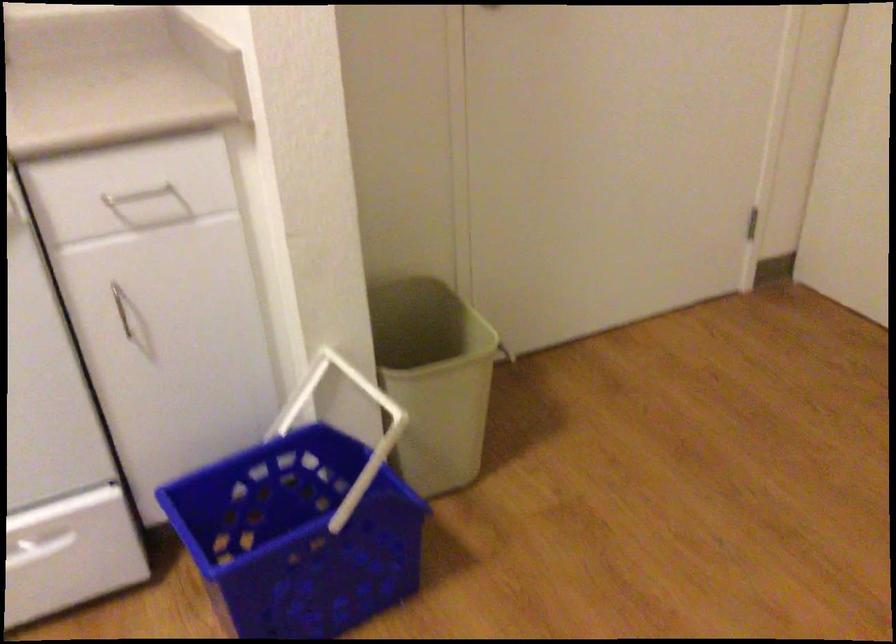
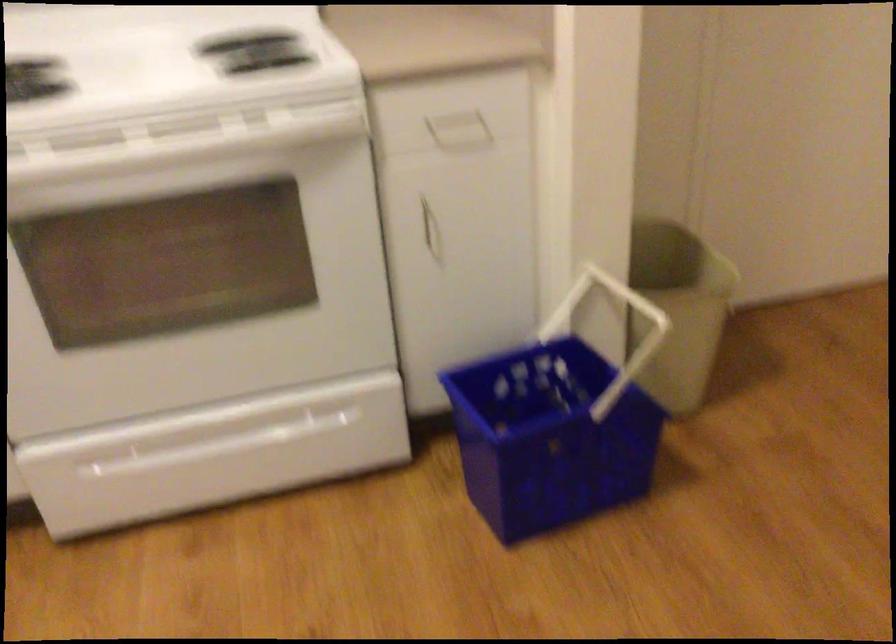
Find the pixel in the second image that matches the point at 371,412 in the first image.

(616, 330)